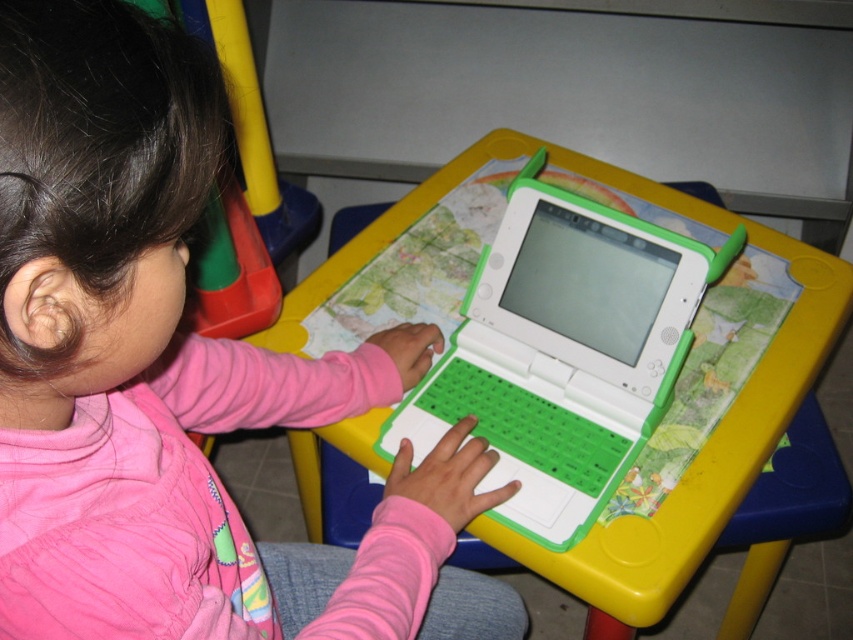
You are a parent trying to locate two points in the image. The first point is at coordinates point (x=10, y=499) and the second is at point (x=494, y=152). Which point is closer to the child?

Point (x=10, y=499) is in front of point (x=494, y=152), so it is closer to the child.

Where is the pink fleece shirt at center in the image?

The pink fleece shirt at center is located at point (x=177, y=378).